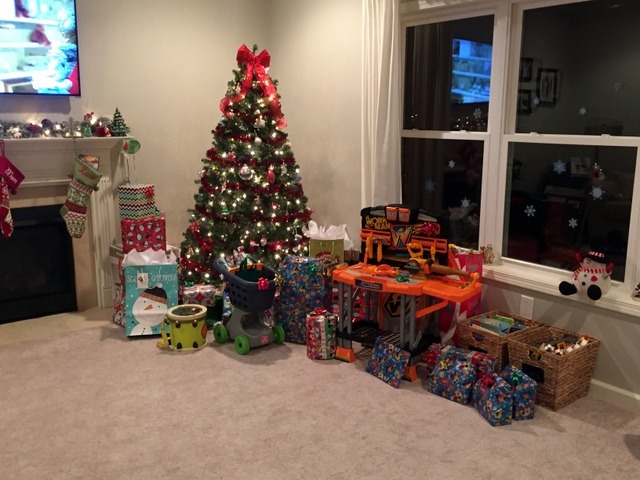
Find the location of a particular element. The width and height of the screenshot is (640, 480). fireplace is located at coordinates (34, 256).